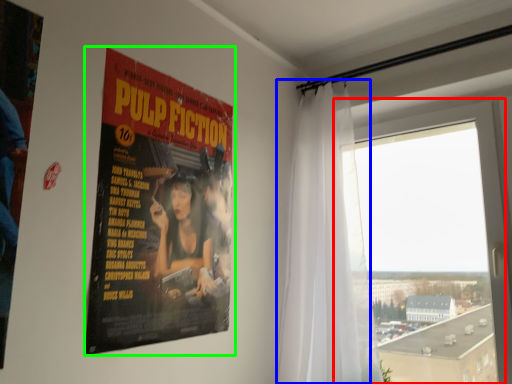
Question: Which object is the farthest from window (highlighted by a red box)? Choose among these: curtain (highlighted by a blue box) or poster (highlighted by a green box).

Choices:
 (A) curtain
 (B) poster

Answer: (B)